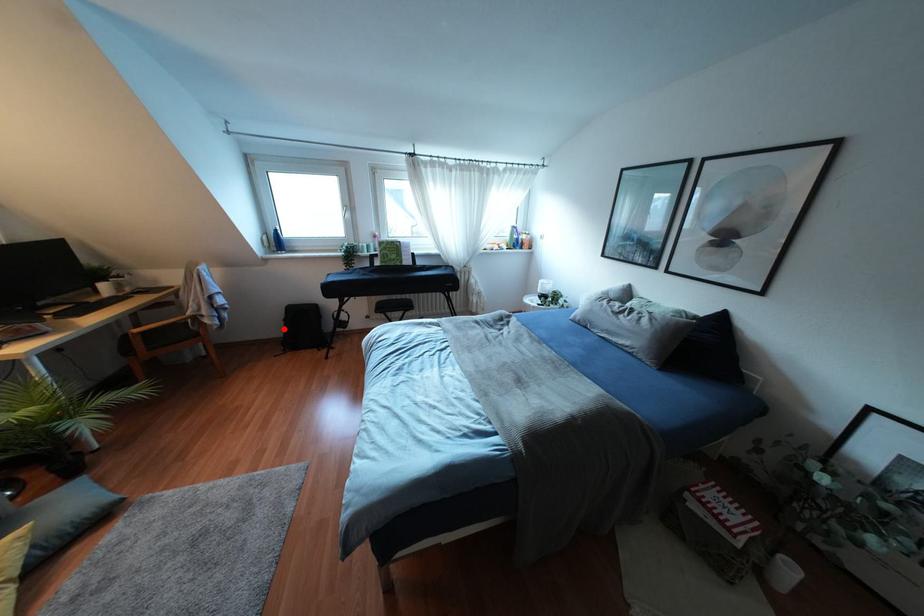
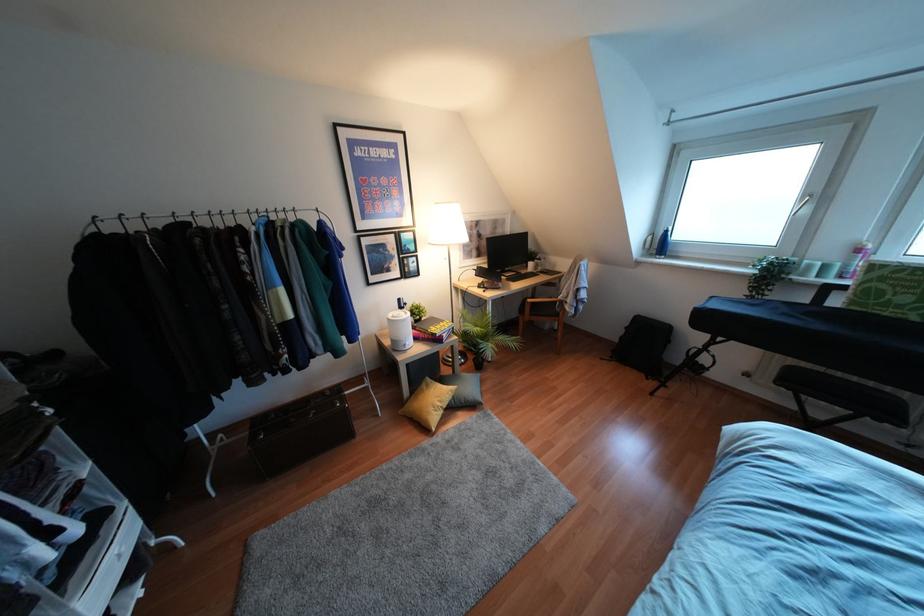
Locate, in the second image, the point that corresponds to the highlighted location in the first image.

(621, 337)